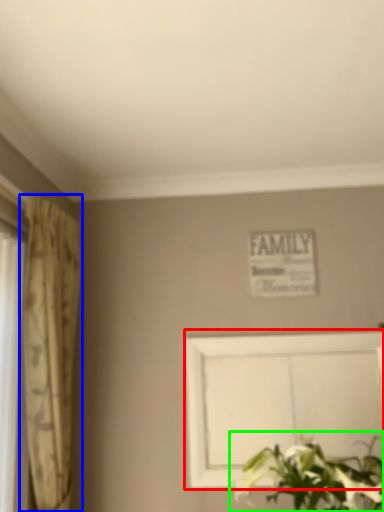
Question: Considering the real-world distances, which object is closest to picture frame (highlighted by a red box)? curtain (highlighted by a blue box) or floral arrangement (highlighted by a green box).

Choices:
 (A) curtain
 (B) floral arrangement

Answer: (B)